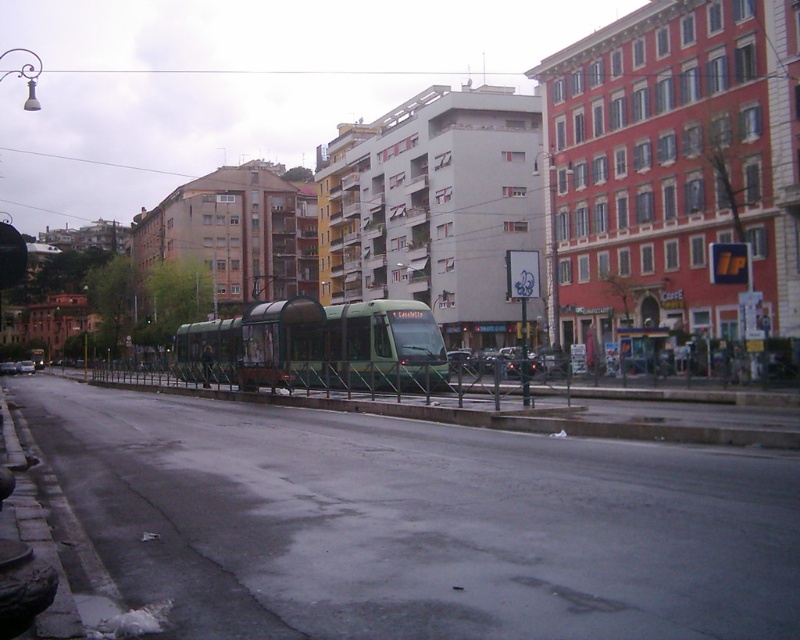
Is point (252, 358) less distant than point (26, 371)?

Yes, it is.

Is green metallic train at center thinner than metallic silver car at center?

Incorrect, green metallic train at center's width is not less than metallic silver car at center's.

At what (x,y) coordinates should I click in order to perform the action: click on green metallic train at center. Please return your answer as a coordinate pair (x, y). Looking at the image, I should click on (318, 346).